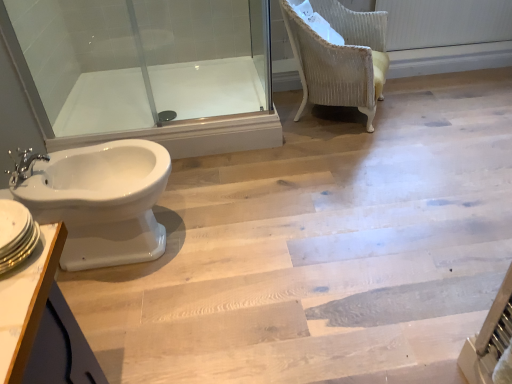
Locate an element on the screen. free space in front of white glossy bidet at lower left is located at coordinates point(144,324).